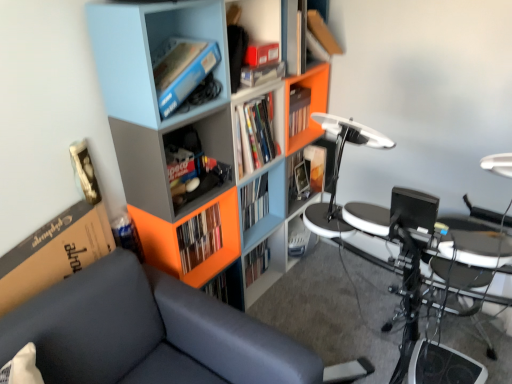
Question: Can you confirm if metallic silver drum set at lower right is shorter than dark gray fabric couch at left?

Choices:
 (A) yes
 (B) no

Answer: (A)

Question: From a real-world perspective, is metallic silver drum set at lower right below dark gray fabric couch at left?

Choices:
 (A) no
 (B) yes

Answer: (B)

Question: Is metallic silver drum set at lower right outside of dark gray fabric couch at left?

Choices:
 (A) no
 (B) yes

Answer: (B)

Question: Is dark gray fabric couch at left completely or partially inside metallic silver drum set at lower right?

Choices:
 (A) yes
 (B) no

Answer: (B)

Question: Is dark gray fabric couch at left at the back of metallic silver drum set at lower right?

Choices:
 (A) yes
 (B) no

Answer: (B)

Question: In terms of height, does metallic silver drum set at lower right look taller or shorter compared to orange matte bookshelf at center, the second book from the top?

Choices:
 (A) short
 (B) tall

Answer: (A)

Question: In terms of width, does metallic silver drum set at lower right look wider or thinner when compared to orange matte bookshelf at center, placed as the 2th book when sorted from back to front?

Choices:
 (A) thin
 (B) wide

Answer: (B)

Question: From a real-world perspective, relative to orange matte bookshelf at center, which ranks as the 1th book in left-to-right order, is metallic silver drum set at lower right vertically above or below?

Choices:
 (A) below
 (B) above

Answer: (A)

Question: Visually, is metallic silver drum set at lower right positioned to the left or to the right of orange matte bookshelf at center, the 2th book viewed from the right?

Choices:
 (A) right
 (B) left

Answer: (A)

Question: Considering the positions of matte plastic book at center, which appears as the 1th book when viewed from the right, and orange matte bookshelf at center, the second book from the top, in the image, is matte plastic book at center, which appears as the 1th book when viewed from the right, taller or shorter than orange matte bookshelf at center, the second book from the top,?

Choices:
 (A) short
 (B) tall

Answer: (A)

Question: Considering the positions of matte plastic book at center, which appears as the 1th book when viewed from the right, and orange matte bookshelf at center, the 2th book viewed from the right, in the image, is matte plastic book at center, which appears as the 1th book when viewed from the right, wider or thinner than orange matte bookshelf at center, the 2th book viewed from the right,?

Choices:
 (A) thin
 (B) wide

Answer: (B)

Question: From a real-world perspective, relative to orange matte bookshelf at center, the first book ordered from the bottom, is matte plastic book at center, which is the second book in bottom-to-top order, vertically above or below?

Choices:
 (A) above
 (B) below

Answer: (A)

Question: Does point (315, 190) appear closer or farther from the camera than point (193, 226)?

Choices:
 (A) closer
 (B) farther

Answer: (B)

Question: Is matte blue bookshelf at upper left, which is the second shelf in top-to-bottom order, in front of or behind matte plastic book at center, which is the first book from top to bottom, in the image?

Choices:
 (A) behind
 (B) front

Answer: (B)

Question: Is point (153, 87) positioned closer to the camera than point (322, 155)?

Choices:
 (A) closer
 (B) farther

Answer: (A)